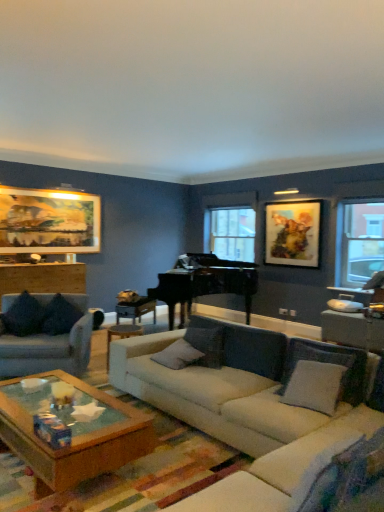
Question: From the image's perspective, is transparent glass window at right, the 2th window from the left, positioned above or below gray fabric pillow at center, arranged as the second pillow when viewed from the right?

Choices:
 (A) below
 (B) above

Answer: (B)

Question: Is transparent glass window at right, which is the 1th window from right to left, inside or outside of gray fabric pillow at center, which is the fourth pillow in left-to-right order?

Choices:
 (A) inside
 (B) outside

Answer: (B)

Question: Which is nearer to the velvet dark blue pillow at left, which is the 1th pillow from left to right?

Choices:
 (A) dark fabric pillow at left, which appears as the second pillow when viewed from the left
 (B) wooden table at left, positioned as the second table in right-to-left order
 (C) black polished piano at center
 (D) white fabric couch at center, placed as the first studio couch when sorted from right to left
 (E) gray fabric pillow at center, the first pillow viewed from the right

Answer: (A)

Question: Which is nearer to the wooden side table at center?

Choices:
 (A) transparent glass window at right, arranged as the 2th window when viewed from the back
 (B) dark fabric pillow at left, which appears as the second pillow when viewed from the left
 (C) wooden table at right, the 2th table from the left
 (D) wooden table at left, positioned as the second table in right-to-left order
 (E) gray fabric pillow at center, the first pillow viewed from the right

Answer: (B)